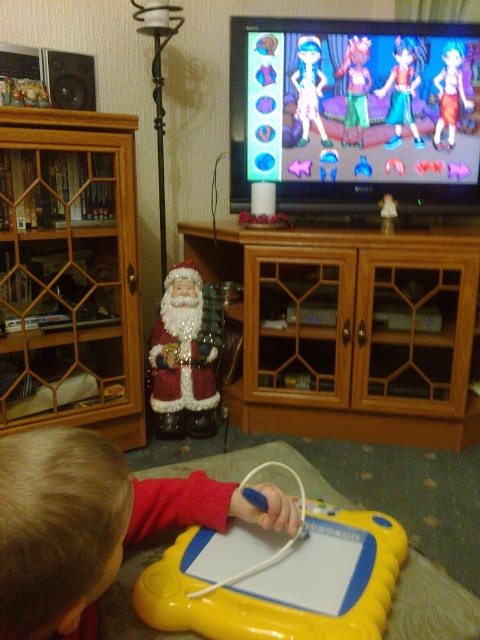
Question: Which point is closer to the camera?

Choices:
 (A) yellow plastic tablet at lower center
 (B) wooden cabinet at left
 (C) wooden cabinet at center

Answer: (A)

Question: Is smooth yellow tablet at lower center positioned in front of yellow plastic tablet at lower center?

Choices:
 (A) no
 (B) yes

Answer: (B)

Question: From the image, what is the correct spatial relationship of smooth yellow tablet at lower center in relation to yellow plastic tablet at lower center?

Choices:
 (A) right
 (B) left

Answer: (B)

Question: Which of the following is the farthest from the observer?

Choices:
 (A) (442, 96)
 (B) (391, 394)
 (C) (176, 592)
 (D) (309, 86)

Answer: (D)

Question: Which of the following is the farthest from the observer?

Choices:
 (A) (436, 140)
 (B) (297, 88)

Answer: (A)

Question: Does satin-like red santa claus at center lie behind matte plastic toy at upper right?

Choices:
 (A) no
 (B) yes

Answer: (B)